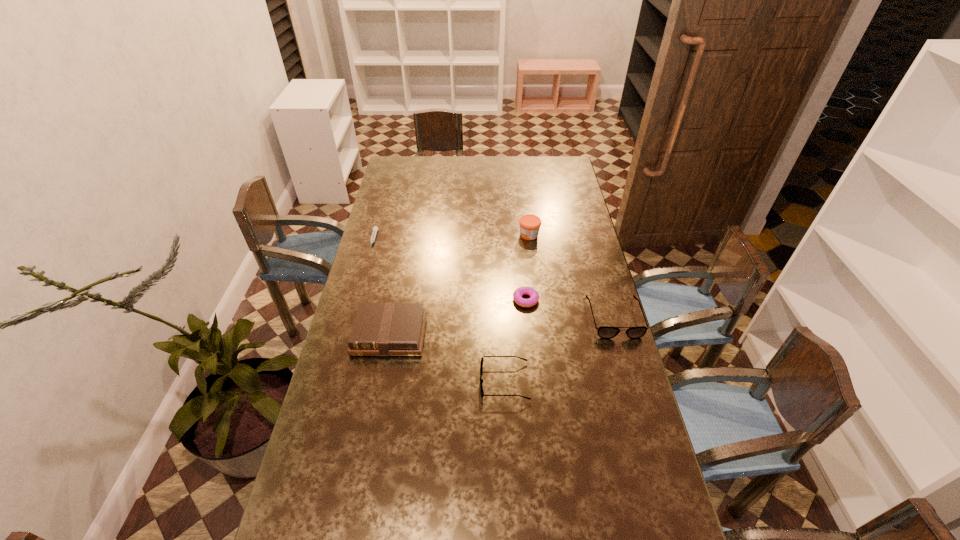
Where is `Bible that is at the left edge`? Bible that is at the left edge is located at coordinates (379, 329).

The image size is (960, 540). In order to click on object located at the right edge in this screenshot , I will do `click(605, 332)`.

Identify the location of vacant space at the far edge of the desktop. The image size is (960, 540). (490, 161).

Locate an element on the screen. This screenshot has width=960, height=540. free region at the near edge is located at coordinates (401, 538).

At what (x,y) coordinates should I click in order to perform the action: click on vacant space at the left edge. Please return your answer as a coordinate pair (x, y). This screenshot has height=540, width=960. Looking at the image, I should click on coord(388,195).

Identify the location of blank space at the right edge of the desktop. point(553,197).

Identify the location of vacant space at the near right corner of the desktop. This screenshot has height=540, width=960. (642, 532).

Find the location of a particular element. The width and height of the screenshot is (960, 540). free point between the second object from left to right and the tallest object is located at coordinates (459, 285).

Locate an element on the screen. The width and height of the screenshot is (960, 540). vacant point located between the Bible and the farther spectacles is located at coordinates (502, 326).

Image resolution: width=960 pixels, height=540 pixels. Identify the location of free space between the jam and the leftmost object. (451, 238).